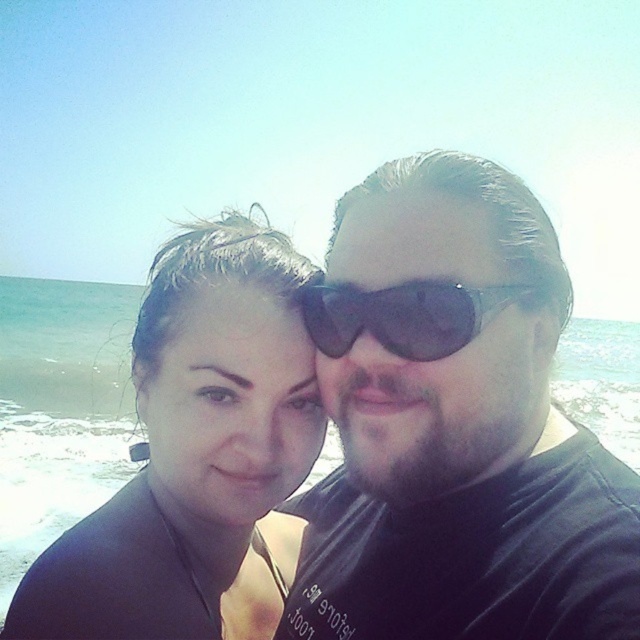
Question: In this image, where is matte black wetsuit at center located relative to black plastic sunglasses at center?

Choices:
 (A) above
 (B) below

Answer: (B)

Question: Is matte black wetsuit at center smaller than black plastic sunglasses at center?

Choices:
 (A) yes
 (B) no

Answer: (B)

Question: Which object appears farthest from the camera in this image?

Choices:
 (A) matte black wetsuit at center
 (B) black plastic sunglasses at center

Answer: (A)

Question: Does matte black wetsuit at center have a greater width compared to black plastic sunglasses at center?

Choices:
 (A) yes
 (B) no

Answer: (A)

Question: Among these objects, which one is farthest from the camera?

Choices:
 (A) black plastic sunglasses at center
 (B) matte black wetsuit at center

Answer: (B)

Question: Which object is farther from the camera taking this photo?

Choices:
 (A) matte black wetsuit at center
 (B) black plastic sunglasses at center

Answer: (A)